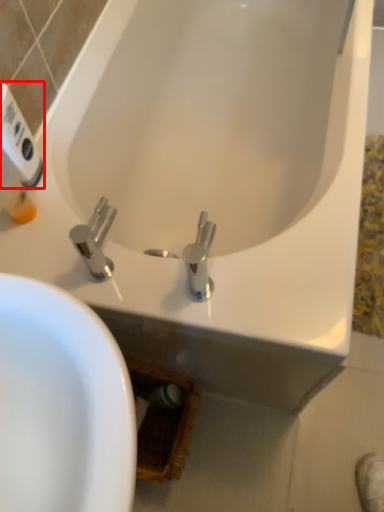
Question: From the image's perspective, what is the correct spatial relationship of hand dryer (annotated by the red box) in relation to tap?

Choices:
 (A) below
 (B) above

Answer: (B)